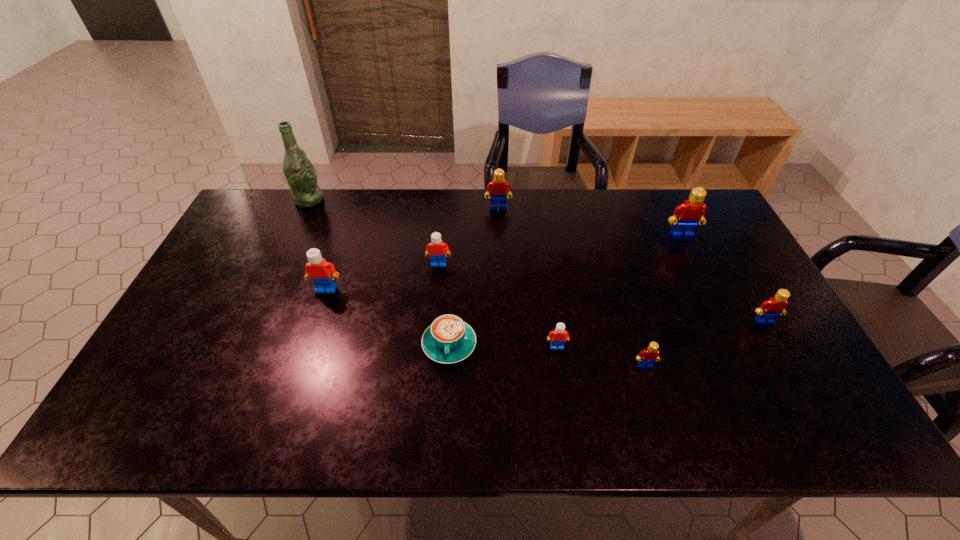
The width and height of the screenshot is (960, 540). I want to click on the fifth farthest Lego, so click(x=769, y=310).

This screenshot has width=960, height=540. Identify the location of the rightmost Lego. (769, 310).

Find the location of a particular element. Image resolution: width=960 pixels, height=540 pixels. the third red Lego from right to left is located at coordinates (651, 354).

Locate an element on the screen. the fifth Lego from left to right is located at coordinates (651, 354).

Where is `the smallest white Lego`? The width and height of the screenshot is (960, 540). the smallest white Lego is located at coordinates (559, 335).

What are the coordinates of `the rightmost white Lego` in the screenshot? It's located at (559, 335).

Identify the location of cappuccino. (448, 339).

The width and height of the screenshot is (960, 540). I want to click on turquoise cappuccino, so click(x=448, y=339).

Identify the location of free spot located 0.080m on the surface of the beer bottle. The image size is (960, 540). (346, 200).

Identify the location of free space located on the front-facing side of the biggest red Lego. (728, 330).